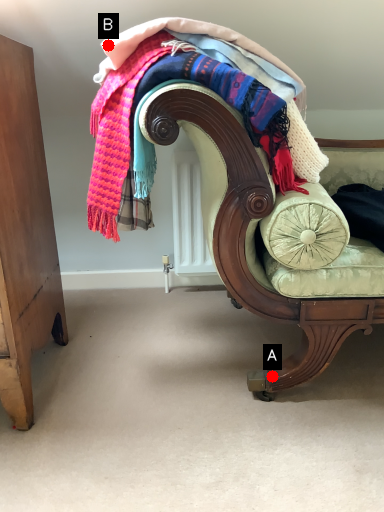
Question: Two points are circled on the image, labeled by A and B beside each circle. Which point is closer to the camera?

Choices:
 (A) A is closer
 (B) B is closer

Answer: (B)